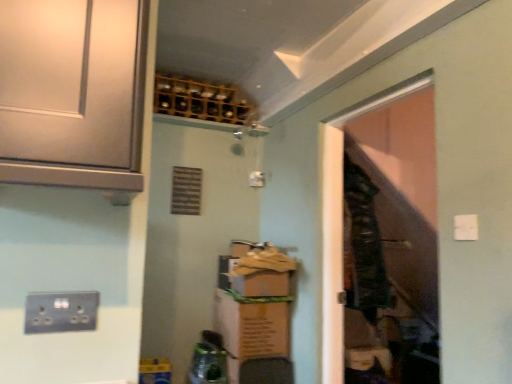
You are a GUI agent. You are given a task and a screenshot of the screen. Output one action in this format:
    pyautogui.click(x=<x>, y=<y>)
    Task: Click on the white plastic light switch at upper right
    The height and width of the screenshot is (384, 512).
    Given the screenshot: What is the action you would take?
    pyautogui.click(x=466, y=227)

Describe the element at coordinates (61, 312) in the screenshot. I see `metallic socket at lower left` at that location.

At what (x,y) coordinates should I click in order to perform the action: click on wooden wine rack at upper center. Please return your answer as a coordinate pair (x, y). Looking at the image, I should click on (200, 100).

The image size is (512, 384). Find the location of `white plastic light switch at upper right`. white plastic light switch at upper right is located at coordinates (466, 227).

Considering the relative sizes of dark green fabric laundry at center and satin white door at upper left in the image provided, is dark green fabric laundry at center thinner than satin white door at upper left?

Indeed, dark green fabric laundry at center has a lesser width compared to satin white door at upper left.

Does dark green fabric laundry at center have a smaller size compared to satin white door at upper left?

No, dark green fabric laundry at center is not smaller than satin white door at upper left.

Could you tell me if dark green fabric laundry at center is facing satin white door at upper left?

No, dark green fabric laundry at center is not aimed at satin white door at upper left.

Is point (77, 294) positioned before point (88, 87)?

No, it is behind (88, 87).

From the image's perspective, which one is positioned higher, metallic socket at lower left or satin white door at upper left?

satin white door at upper left, from the image's perspective.

From a real-world perspective, is metallic socket at lower left physically below satin white door at upper left?

Yes, from a real-world perspective, metallic socket at lower left is under satin white door at upper left.

Between dark green fabric laundry at center and metallic socket at lower left, which one has larger size?

dark green fabric laundry at center is bigger.

Is dark green fabric laundry at center positioned beyond the bounds of metallic socket at lower left?

Yes, dark green fabric laundry at center is located beyond the bounds of metallic socket at lower left.

Between dark green fabric laundry at center and metallic socket at lower left, which one appears on the left side from the viewer's perspective?

Positioned to the left is metallic socket at lower left.

Is dark green fabric laundry at center wider or thinner than metallic socket at lower left?

In the image, dark green fabric laundry at center appears to be wider than metallic socket at lower left.

Is transparent plastic door at right completely or partially outside of wooden wine rack at upper center?

transparent plastic door at right lies outside wooden wine rack at upper center's area.

Considering the relative sizes of transparent plastic door at right and wooden wine rack at upper center in the image provided, is transparent plastic door at right wider than wooden wine rack at upper center?

No.

This screenshot has height=384, width=512. Identify the location of glass door lying in front of the wooden wine rack at upper center. (341, 217).

Where is `cardboard box that is on the right side of metallic socket at lower left`? This screenshot has height=384, width=512. cardboard box that is on the right side of metallic socket at lower left is located at coordinates (252, 325).

Measure the distance from metallic socket at lower left to brown cardboard box at center.

metallic socket at lower left and brown cardboard box at center are 5.26 feet apart.

Is metallic socket at lower left positioned in front of brown cardboard box at center?

That is True.

How different are the orientations of metallic socket at lower left and brown cardboard box at center in degrees?

The angle between the facing direction of metallic socket at lower left and the facing direction of brown cardboard box at center is 0.647 degrees.

From a real-world perspective, is metallic socket at lower left above or below dark green fabric laundry at center?

From a real-world perspective, metallic socket at lower left is physically below dark green fabric laundry at center.

Is point (26, 306) closer or farther from the camera than point (357, 284)?

Clearly, point (26, 306) is closer to the camera than point (357, 284).

Considering the relative sizes of metallic socket at lower left and dark green fabric laundry at center in the image provided, is metallic socket at lower left taller than dark green fabric laundry at center?

No, metallic socket at lower left is not taller than dark green fabric laundry at center.

Considering the points (190, 106) and (326, 263), which point is in front, point (190, 106) or point (326, 263)?

Point (326, 263)

Is wooden wine rack at upper center oriented towards transparent plastic door at right?

No, wooden wine rack at upper center is not aimed at transparent plastic door at right.

Is transparent plastic door at right completely or partially inside wooden wine rack at upper center?

Definitely not — transparent plastic door at right is not inside wooden wine rack at upper center.

You are a GUI agent. You are given a task and a screenshot of the screen. Output one action in this format:
    pyautogui.click(x=<x>, y=<y>)
    Task: Click on the cabinetry located above the dark green fabric laundry at center (from the image's perspective)
    The height and width of the screenshot is (384, 512).
    Given the screenshot: What is the action you would take?
    pyautogui.click(x=73, y=92)

The width and height of the screenshot is (512, 384). I want to click on electric outlet that appears below the satin white door at upper left (from a real-world perspective), so click(x=61, y=312).

In the scene shown: From the image, which object appears to be nearer to dark green fabric laundry at center, brown cardboard box at center or transparent plastic door at right?

Among the two, transparent plastic door at right is located nearer to dark green fabric laundry at center.

From the image, which object appears to be farther from dark green fabric laundry at center, satin white door at upper left or brown cardboard box at center?

satin white door at upper left is further to dark green fabric laundry at center.

From the image, which object appears to be farther from brown cardboard box at center, wooden wine rack at upper center or metallic socket at lower left?

metallic socket at lower left is further to brown cardboard box at center.

From the image, which object appears to be nearer to white plastic light switch at upper right, wooden wine rack at upper center or transparent plastic door at right?

transparent plastic door at right is positioned closer to the anchor white plastic light switch at upper right.

Considering their positions, is dark green fabric laundry at center positioned further to brown cardboard box at center than white plastic light switch at upper right?

Among the two, white plastic light switch at upper right is located further to brown cardboard box at center.

When comparing their distances from metallic socket at lower left, does brown cardboard box at center or transparent plastic door at right seem closer?

transparent plastic door at right is positioned closer to the anchor metallic socket at lower left.

Which object lies nearer to the anchor point dark green fabric laundry at center, brown cardboard box at center or white plastic light switch at upper right?

Based on the image, brown cardboard box at center appears to be nearer to dark green fabric laundry at center.

Which object lies nearer to the anchor point wooden wine rack at upper center, metallic socket at lower left or transparent plastic door at right?

transparent plastic door at right is positioned closer to the anchor wooden wine rack at upper center.

Image resolution: width=512 pixels, height=384 pixels. I want to click on glass door between metallic socket at lower left and wooden wine rack at upper center along the z-axis, so click(341, 217).

Identify the location of laundry between white plastic light switch at upper right and brown cardboard box at center from front to back. (362, 245).

Where is `glass door between white plastic light switch at upper right and wooden wine rack at upper center from front to back`? glass door between white plastic light switch at upper right and wooden wine rack at upper center from front to back is located at coordinates (341, 217).

Where is `laundry between metallic socket at lower left and brown cardboard box at center from front to back`? The height and width of the screenshot is (384, 512). laundry between metallic socket at lower left and brown cardboard box at center from front to back is located at coordinates (362, 245).